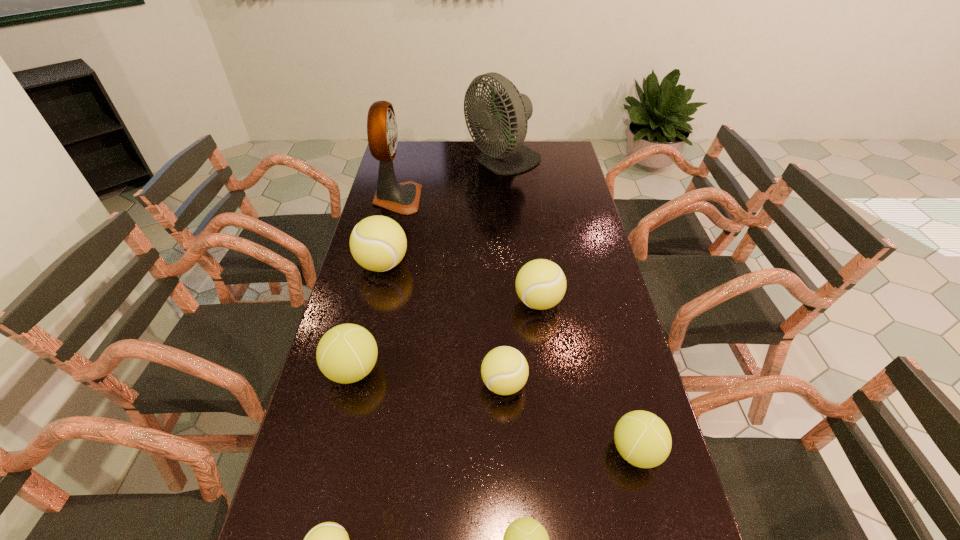
Locate an element on the screen. object that is at the far edge is located at coordinates point(509,108).

Locate an element on the screen. The height and width of the screenshot is (540, 960). fan situated at the left edge is located at coordinates (403, 198).

Locate an element on the screen. This screenshot has height=540, width=960. fan present at the right edge is located at coordinates (509, 108).

Locate an element on the screen. This screenshot has height=540, width=960. tennis ball that is at the right edge is located at coordinates (643, 439).

The image size is (960, 540). I want to click on object that is at the far right corner, so click(x=509, y=108).

Where is `vacant space at the left edge of the desktop`? This screenshot has height=540, width=960. vacant space at the left edge of the desktop is located at coordinates pyautogui.click(x=367, y=314).

You are a GUI agent. You are given a task and a screenshot of the screen. Output one action in this format:
    pyautogui.click(x=<x>, y=<y>)
    Task: Click on the blank space at the right edge of the desktop
    The image size is (960, 540).
    Given the screenshot: What is the action you would take?
    pyautogui.click(x=564, y=175)

Find the location of a particular element. empty space that is in between the right fan and the fourth farthest object is located at coordinates (521, 233).

This screenshot has height=540, width=960. What are the coordinates of `vacant area that lies between the left fan and the second nearest yellow tennis ball` in the screenshot? It's located at (450, 292).

Where is `free spot between the second farthest green tennis ball and the third farthest yellow tennis ball`? This screenshot has width=960, height=540. free spot between the second farthest green tennis ball and the third farthest yellow tennis ball is located at coordinates (570, 417).